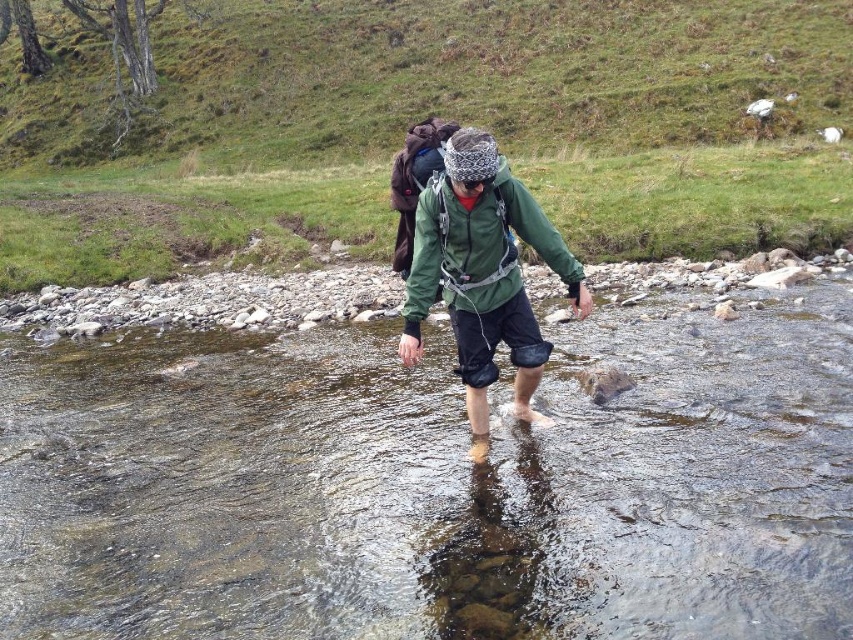
You are a hiker who needs to cross the stream while keeping your backpack dry. Which object, the green grass at upper center or the green matte jacket at center, is taller and could potentially block your path?

The green grass at upper center is much taller than the green matte jacket at center, so it could potentially block your path and keep your backpack dry.

You are navigating through the stream and want to reach the point marked as point (357, 51). You are currently at point (368, 618). Given the stream is shallow and rocky, which direction should you move relative to your current position to get closer to your destination?

You should move backward because point (368, 618) is in front of point (357, 51), so to reach the latter, you need to go in the opposite direction.

You are a hiker trying to cross the stream. You see the clear water at center and the green matte jacket at center. Which object is closer to you as you approach the stream?

The clear water at center is closer to you because it is in front of the green matte jacket at center.